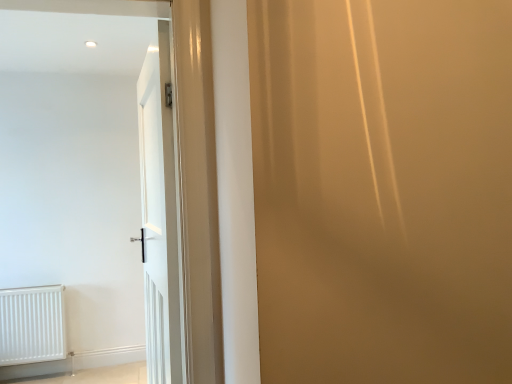
Where is `white matte radiator at lower left`? Image resolution: width=512 pixels, height=384 pixels. white matte radiator at lower left is located at coordinates (32, 325).

Describe the element at coordinates (32, 325) in the screenshot. This screenshot has height=384, width=512. I see `white matte radiator at lower left` at that location.

In order to face white glossy door at center, should I rotate leftwards or rightwards?

You should look left and rotate roughly 13.566 degrees.

The height and width of the screenshot is (384, 512). Describe the element at coordinates (159, 214) in the screenshot. I see `white glossy door at center` at that location.

Where is `white glossy door at center`? Image resolution: width=512 pixels, height=384 pixels. white glossy door at center is located at coordinates (159, 214).

Find the location of a particular element. The image size is (512, 384). white matte radiator at lower left is located at coordinates (32, 325).

In the image, is white matte radiator at lower left on the left side or the right side of white glossy door at center?

In the image, white matte radiator at lower left appears on the left side of white glossy door at center.

Which object is closer to the camera, white matte radiator at lower left or white glossy door at center?

white glossy door at center.

Which is closer, (38, 331) or (176, 254)?

The point (176, 254) is in front.

From the image's perspective, does white matte radiator at lower left appear higher than white glossy door at center?

No, from the image's perspective, white matte radiator at lower left is not over white glossy door at center.

From a real-world perspective, is white matte radiator at lower left positioned under white glossy door at center based on gravity?

Yes, from a real-world perspective, white matte radiator at lower left is under white glossy door at center.

Consider the image. Is white matte radiator at lower left thinner than white glossy door at center?

No, white matte radiator at lower left is not thinner than white glossy door at center.

Considering the sizes of objects white matte radiator at lower left and white glossy door at center in the image provided, who is shorter, white matte radiator at lower left or white glossy door at center?

Standing shorter between the two is white matte radiator at lower left.

Who is smaller, white matte radiator at lower left or white glossy door at center?

Smaller between the two is white matte radiator at lower left.

Can we say white matte radiator at lower left lies outside white glossy door at center?

Yes.

Based on the photo, is white matte radiator at lower left touching white glossy door at center?

white matte radiator at lower left and white glossy door at center are clearly separated.

Is white matte radiator at lower left facing towards white glossy door at center?

Yes, white matte radiator at lower left is aimed at white glossy door at center.

How different are the orientations of white matte radiator at lower left and white glossy door at center in degrees?

white matte radiator at lower left and white glossy door at center are facing 82.5 degrees away from each other.

You are a GUI agent. You are given a task and a screenshot of the screen. Output one action in this format:
    pyautogui.click(x=<x>, y=<y>)
    Task: Click on the door to the right of white matte radiator at lower left
    
    Given the screenshot: What is the action you would take?
    pyautogui.click(x=159, y=214)

Would you say white glossy door at center is to the left or to the right of white matte radiator at lower left in the picture?

In the image, white glossy door at center appears on the right side of white matte radiator at lower left.

Between white glossy door at center and white matte radiator at lower left, which one is positioned in front?

Positioned in front is white glossy door at center.

Which is farther, (166,84) or (42,359)?

The point (42,359) is behind.

From the image's perspective, is white glossy door at center located above or below white matte radiator at lower left?

Clearly, from the image's perspective, white glossy door at center is above white matte radiator at lower left.

Looking at this image, from a real-world perspective, which object stands above the other?

From a 3D spatial view, white glossy door at center is above.

From the picture: Considering the sizes of objects white glossy door at center and white matte radiator at lower left in the image provided, who is wider, white glossy door at center or white matte radiator at lower left?

Wider between the two is white matte radiator at lower left.

Between white glossy door at center and white matte radiator at lower left, which one has less height?

white matte radiator at lower left is shorter.

Considering the sizes of white glossy door at center and white matte radiator at lower left in the image, is white glossy door at center bigger or smaller than white matte radiator at lower left?

white glossy door at center is bigger than white matte radiator at lower left.

Is white glossy door at center not within white matte radiator at lower left?

That's correct, white glossy door at center is outside of white matte radiator at lower left.

Would you consider white glossy door at center to be distant from white matte radiator at lower left?

Yes, white glossy door at center and white matte radiator at lower left are quite far apart.

From the picture: Could you tell me if white glossy door at center is facing white matte radiator at lower left?

No, white glossy door at center is not turned towards white matte radiator at lower left.

What's the angular difference between white glossy door at center and white matte radiator at lower left's facing directions?

82.5 degrees separate the facing orientations of white glossy door at center and white matte radiator at lower left.

In order to click on door above the white matte radiator at lower left (from a real-world perspective) in this screenshot , I will do `click(159, 214)`.

Find the location of a particular element. The image size is (512, 384). radiator below the white glossy door at center (from the image's perspective) is located at coordinates (32, 325).

This screenshot has height=384, width=512. Find the location of `radiator located underneath the white glossy door at center (from a real-world perspective)`. radiator located underneath the white glossy door at center (from a real-world perspective) is located at coordinates (32, 325).